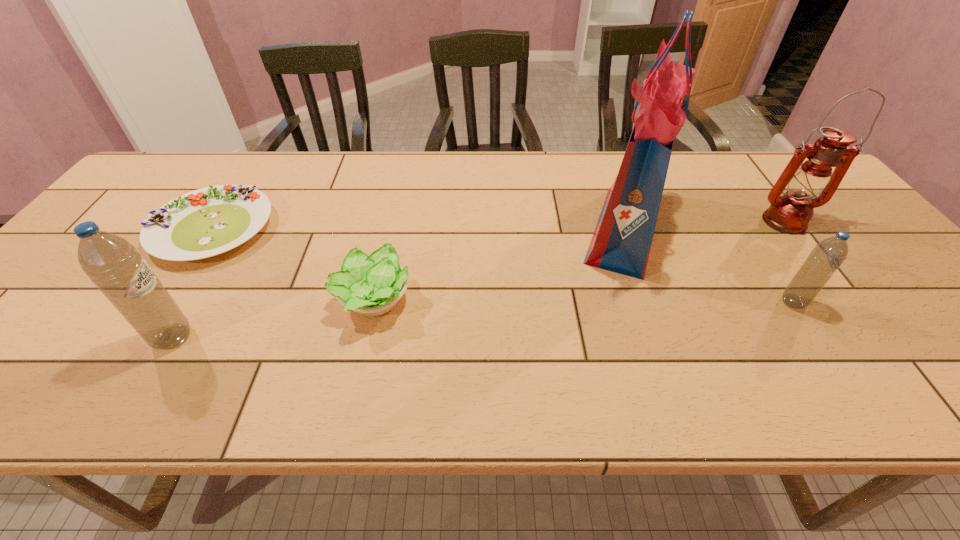
Where is `vacant space at the far left corner of the desktop`? The width and height of the screenshot is (960, 540). vacant space at the far left corner of the desktop is located at coordinates (186, 179).

Where is `vacant space in between the farther water bottle and the rightmost object`? The width and height of the screenshot is (960, 540). vacant space in between the farther water bottle and the rightmost object is located at coordinates (788, 262).

I want to click on free point between the right water bottle and the salad plate, so click(503, 266).

I want to click on vacant area that lies between the oil lamp and the third shortest object, so click(x=788, y=262).

Locate an element on the screen. empty location between the second tallest object and the lettuce is located at coordinates coord(579,261).

Locate an element on the screen. This screenshot has width=960, height=540. free space that is in between the rightmost object and the grocery bag is located at coordinates (704, 225).

Identify the location of free space between the rightmost object and the shortest object. (498, 225).

Image resolution: width=960 pixels, height=540 pixels. I want to click on free space between the fifth shortest object and the left water bottle, so click(478, 280).

Identify the location of free space between the third shortest object and the fourth object from right to left. (x=584, y=301).

Where is `vacant area between the second tallest object and the shorter water bottle`? Image resolution: width=960 pixels, height=540 pixels. vacant area between the second tallest object and the shorter water bottle is located at coordinates pyautogui.click(x=788, y=262).